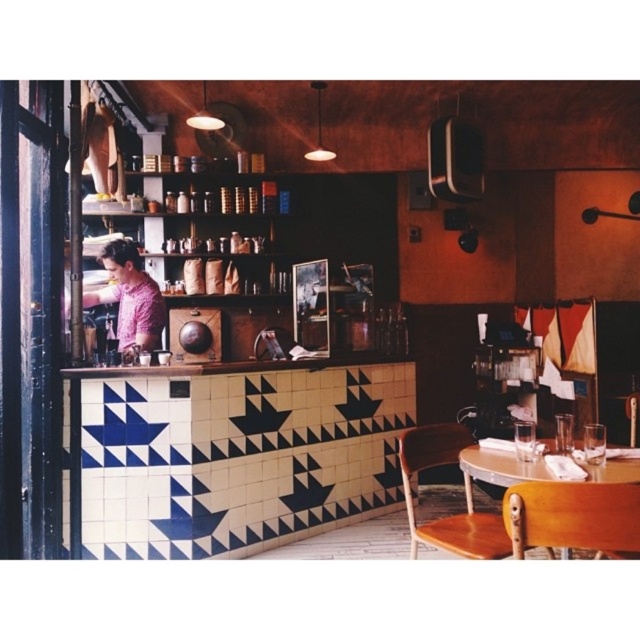
Question: Among these objects, which one is farthest from the camera?

Choices:
 (A) wooden table at lower right
 (B) pink textured shirt at left

Answer: (B)

Question: Among these objects, which one is nearest to the camera?

Choices:
 (A) pink textured shirt at left
 (B) wooden table at lower right

Answer: (B)

Question: Does pink textured shirt at left appear on the left side of wooden table at lower right?

Choices:
 (A) no
 (B) yes

Answer: (B)

Question: Considering the relative positions of pink textured shirt at left and wooden table at lower right in the image provided, where is pink textured shirt at left located with respect to wooden table at lower right?

Choices:
 (A) left
 (B) right

Answer: (A)

Question: Can you confirm if pink textured shirt at left is positioned to the right of wooden table at lower right?

Choices:
 (A) yes
 (B) no

Answer: (B)